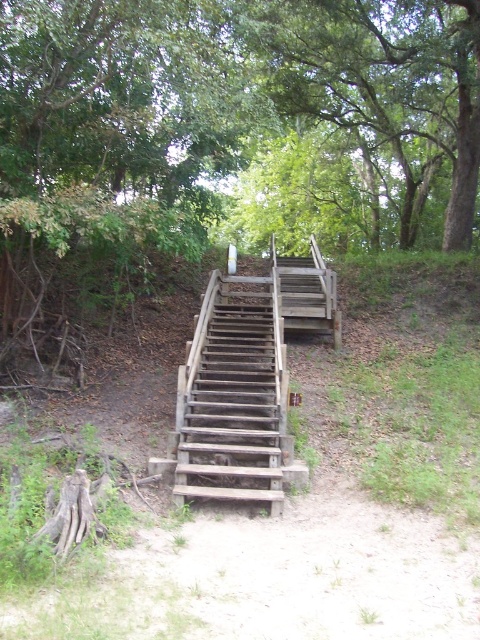
Which is more to the right, green leafy tree at center or green leafy tree at upper center?

Positioned to the right is green leafy tree at upper center.

Can you confirm if green leafy tree at center is positioned below green leafy tree at upper center?

Correct, green leafy tree at center is located below green leafy tree at upper center.

The image size is (480, 640). What do you see at coordinates (226, 134) in the screenshot?
I see `green leafy tree at center` at bounding box center [226, 134].

Identify the location of green leafy tree at center. Image resolution: width=480 pixels, height=640 pixels. (226, 134).

Is green leafy tree at upper center wider than weathered wood stairs at center?

Yes.

Does green leafy tree at upper center appear under weathered wood stairs at center?

No.

Looking at this image, who is more forward, (407, 173) or (215, 410)?

Point (215, 410) is more forward.

Identify the location of green leafy tree at upper center. The image size is (480, 640). (384, 92).

The width and height of the screenshot is (480, 640). What are the coordinates of `green leafy tree at center` in the screenshot? It's located at (226, 134).

Can you confirm if green leafy tree at center is wider than weathered wood stairs at center?

Indeed, green leafy tree at center has a greater width compared to weathered wood stairs at center.

The image size is (480, 640). Identify the location of green leafy tree at center. (226, 134).